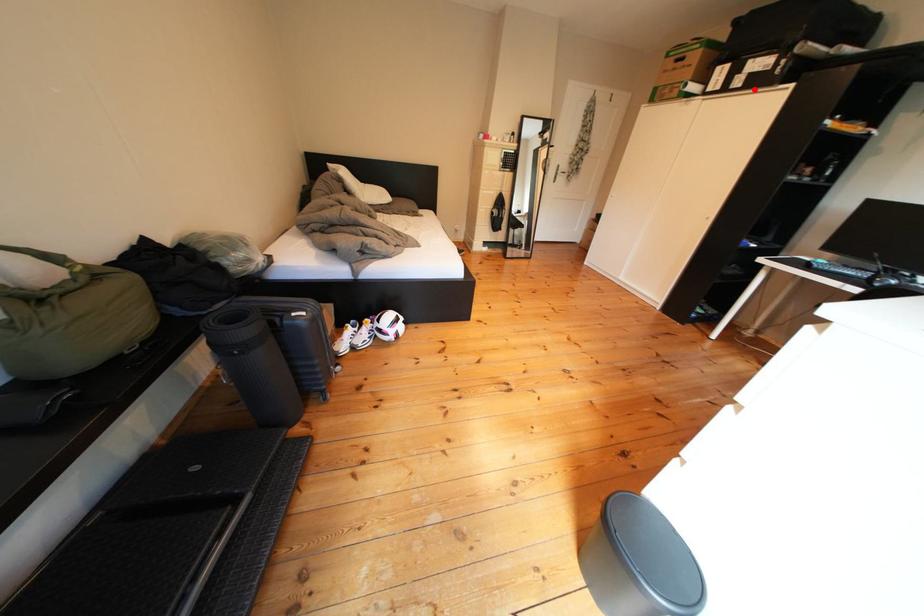
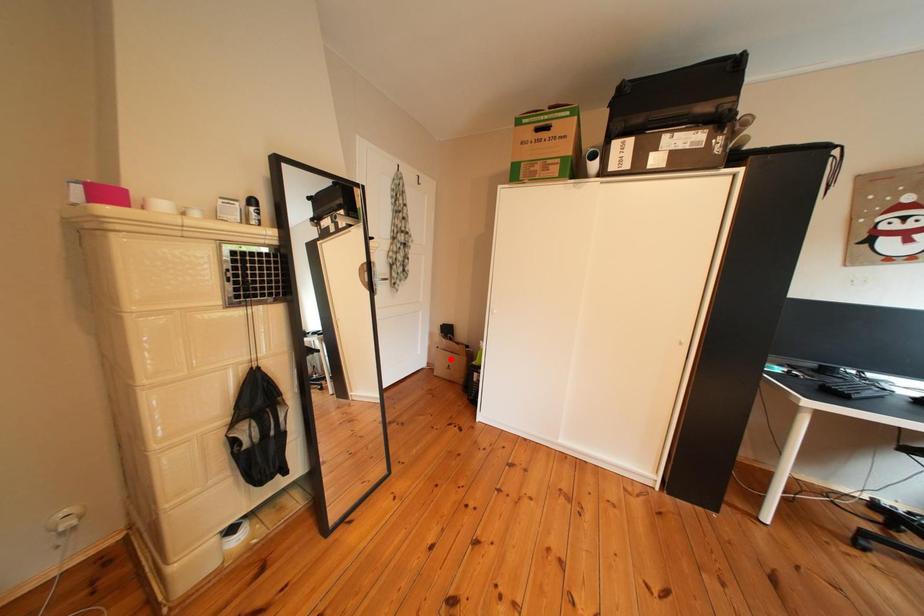
I am providing you with two images of the same scene from different viewpoints. A red point is marked on the first image and another point is marked on the second image. Does the point marked in image1 correspond to the same location as the one in image2?

No